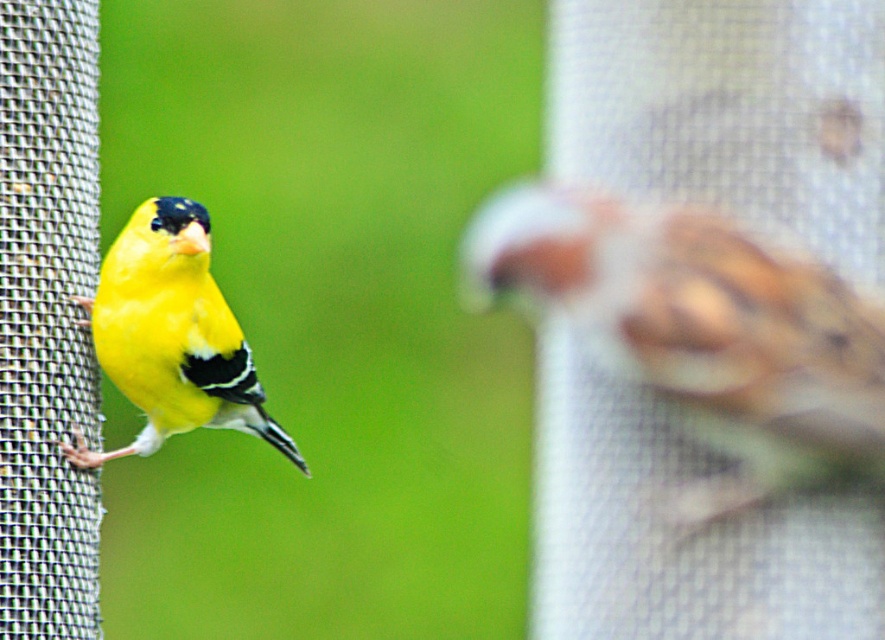
From the picture: You are a birdwatcher observing two birds on a feeder. You see the brown speckled sparrow at right and the shiny yellow canary at left. Which bird is positioned higher on the feeder?

The brown speckled sparrow at right is located above the shiny yellow canary at left, so it is positioned higher on the feeder.

You are a birdwatcher trying to locate the brown speckled sparrow at right in the image. According to the coordinates provided, where exactly is it positioned?

The brown speckled sparrow at right is located at coordinates point (702, 330).